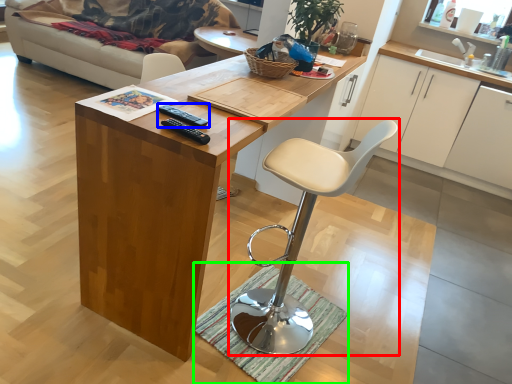
Question: Which object is the farthest from chair (highlighted by a red box)? Choose among these: remote (highlighted by a blue box) or doormat (highlighted by a green box).

Choices:
 (A) remote
 (B) doormat

Answer: (A)